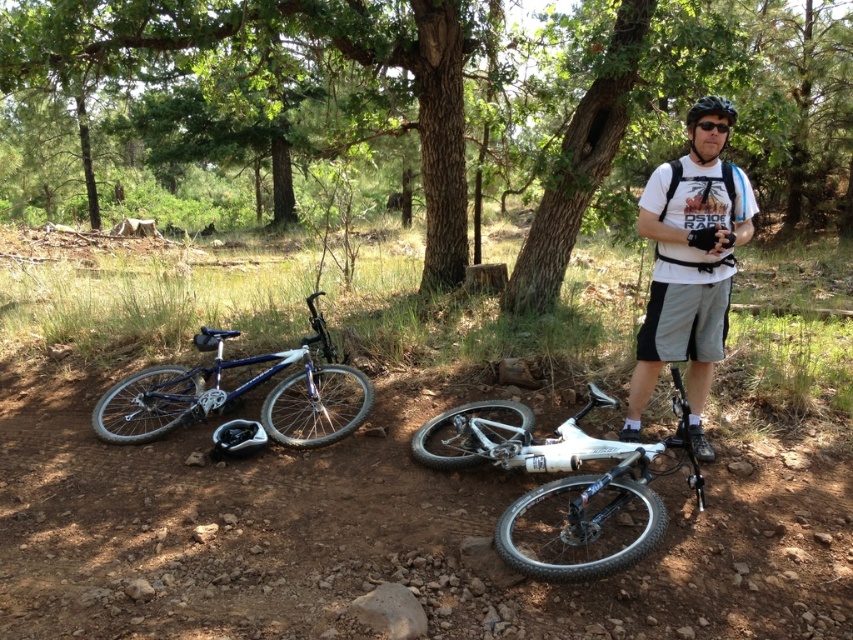
Question: From the image, what is the correct spatial relationship of white matte t-shirt at center in relation to shiny blue matte mountain bike at lower left?

Choices:
 (A) below
 (B) above

Answer: (B)

Question: Which is farther from the black matte sunglasses at upper center?

Choices:
 (A) green leafy tree at center
 (B) shiny blue matte mountain bike at lower left

Answer: (A)

Question: Considering the relative positions of green leafy tree at center and white matte t-shirt at center in the image provided, where is green leafy tree at center located with respect to white matte t-shirt at center?

Choices:
 (A) below
 (B) above

Answer: (B)

Question: Where is white matte bicycle at lower center located in relation to matte black helmet at upper right in the image?

Choices:
 (A) above
 (B) below

Answer: (B)

Question: Considering the real-world distances, which object is farthest from the shiny blue matte mountain bike at lower left?

Choices:
 (A) matte black helmet at upper right
 (B) white matte t-shirt at center
 (C) green leafy tree at center
 (D) dirt track at lower center

Answer: (C)

Question: Considering the real-world distances, which object is closest to the shiny blue matte mountain bike at lower left?

Choices:
 (A) green leafy tree at center
 (B) white matte t-shirt at center
 (C) matte black helmet at upper right

Answer: (B)